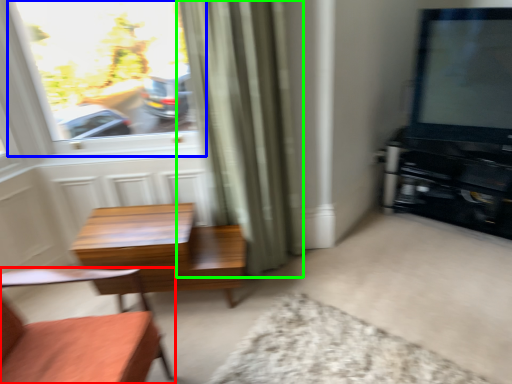
Question: Estimate the real-world distances between objects in this image. Which object is farther from chair (highlighted by a red box), window (highlighted by a blue box) or curtain (highlighted by a green box)?

Choices:
 (A) window
 (B) curtain

Answer: (A)